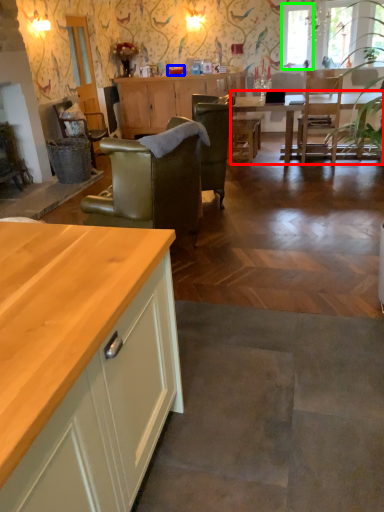
Question: Considering the real-world distances, which object is closest to kitchen & dining room table (highlighted by a red box)? tableware (highlighted by a blue box) or window screen (highlighted by a green box).

Choices:
 (A) tableware
 (B) window screen

Answer: (B)